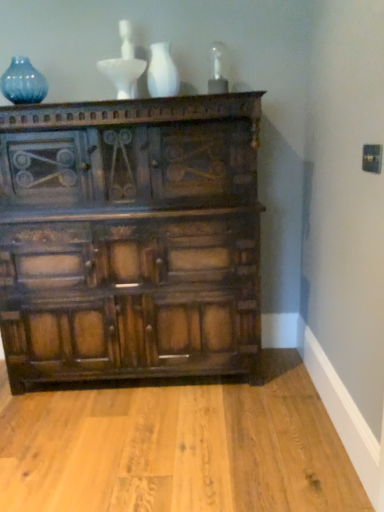
The width and height of the screenshot is (384, 512). What do you see at coordinates (130, 238) in the screenshot?
I see `dark wood chest of drawers at center` at bounding box center [130, 238].

What is the approximate width of white glossy vase at upper center?

6.94 inches.

At what (x,y) coordinates should I click in order to perform the action: click on blue glass vase at upper left. Please return your answer as a coordinate pair (x, y). This screenshot has width=384, height=512. Looking at the image, I should click on (23, 82).

Is white glossy vase at upper center oriented towards blue glass vase at upper left?

No, white glossy vase at upper center is not turned towards blue glass vase at upper left.

Can you confirm if white glossy vase at upper center is smaller than blue glass vase at upper left?

Indeed, white glossy vase at upper center has a smaller size compared to blue glass vase at upper left.

Is white glossy vase at upper center far from blue glass vase at upper left?

Answer: No, white glossy vase at upper center is in close proximity to blue glass vase at upper left.

From a real-world perspective, is white glossy vase at upper center over blue glass vase at upper left?

No, from a real-world perspective, white glossy vase at upper center is not above blue glass vase at upper left.

Looking at this image, is dark wood chest of drawers at center in contact with white glossy vase at upper center?

No, dark wood chest of drawers at center is not with white glossy vase at upper center.

Is point (20, 211) positioned in front of point (169, 95)?

No, it is not.

Would you say dark wood chest of drawers at center is inside or outside white glossy vase at upper center?

dark wood chest of drawers at center is not enclosed by white glossy vase at upper center.

At what (x,y) coordinates should I click in order to perform the action: click on chest of drawers below the white glossy vase at upper center (from the image's perspective). Please return your answer as a coordinate pair (x, y). Looking at the image, I should click on (130, 238).

Which of these two, dark wood chest of drawers at center or blue glass vase at upper left, is wider?

With larger width is dark wood chest of drawers at center.

From a real-world perspective, does dark wood chest of drawers at center stand above blue glass vase at upper left?

No.

From the picture: Would you say dark wood chest of drawers at center is outside blue glass vase at upper left?

Yes, dark wood chest of drawers at center is located beyond the bounds of blue glass vase at upper left.

Would you consider white glossy vase at upper center to be distant from dark wood chest of drawers at center?

No, white glossy vase at upper center is not far from dark wood chest of drawers at center.

Based on their sizes in the image, would you say white glossy vase at upper center is bigger or smaller than dark wood chest of drawers at center?

In the image, white glossy vase at upper center appears to be smaller than dark wood chest of drawers at center.

Is point (149, 74) behind point (123, 216)?

That is True.

Is white glossy vase at upper center wider or thinner than dark wood chest of drawers at center?

In the image, white glossy vase at upper center appears to be more narrow than dark wood chest of drawers at center.

Is the position of blue glass vase at upper left more distant than that of dark wood chest of drawers at center?

Yes, it is behind dark wood chest of drawers at center.

Is blue glass vase at upper left wider or thinner than dark wood chest of drawers at center?

Clearly, blue glass vase at upper left has less width compared to dark wood chest of drawers at center.

Which of these two, blue glass vase at upper left or dark wood chest of drawers at center, stands shorter?

With less height is blue glass vase at upper left.

I want to click on vase located underneath the blue glass vase at upper left (from a real-world perspective), so coord(162,72).

Does point (26, 94) come closer to viewer compared to point (151, 65)?

No, it is not.

Is blue glass vase at upper left looking in the opposite direction of white glossy vase at upper center?

No, blue glass vase at upper left is not facing the opposite direction of white glossy vase at upper center.

Is white glossy vase at upper center a part of blue glass vase at upper left?

Actually, white glossy vase at upper center is outside blue glass vase at upper left.

The image size is (384, 512). I want to click on vase on the right of blue glass vase at upper left, so click(x=162, y=72).

I want to click on vase above the dark wood chest of drawers at center (from the image's perspective), so click(x=162, y=72).

Considering their positions, is dark wood chest of drawers at center positioned closer to white glossy vase at upper center than blue glass vase at upper left?

blue glass vase at upper left lies closer to white glossy vase at upper center than the other object.

Considering their positions, is blue glass vase at upper left positioned further to dark wood chest of drawers at center than white glossy vase at upper center?

blue glass vase at upper left lies further to dark wood chest of drawers at center than the other object.

From the image, which object appears to be nearer to dark wood chest of drawers at center, white glossy vase at upper center or blue glass vase at upper left?

white glossy vase at upper center is positioned closer to the anchor dark wood chest of drawers at center.

From the image, which object appears to be nearer to white glossy vase at upper center, blue glass vase at upper left or dark wood chest of drawers at center?

blue glass vase at upper left lies closer to white glossy vase at upper center than the other object.

Which object lies further to the anchor point blue glass vase at upper left, white glossy vase at upper center or dark wood chest of drawers at center?

dark wood chest of drawers at center is positioned further to the anchor blue glass vase at upper left.

Looking at the image, which one is located closer to blue glass vase at upper left, dark wood chest of drawers at center or white glossy vase at upper center?

white glossy vase at upper center is closer to blue glass vase at upper left.

At what (x,y) coordinates should I click in order to perform the action: click on vase between blue glass vase at upper left and dark wood chest of drawers at center in the vertical direction. Please return your answer as a coordinate pair (x, y). This screenshot has height=512, width=384. Looking at the image, I should click on (162, 72).